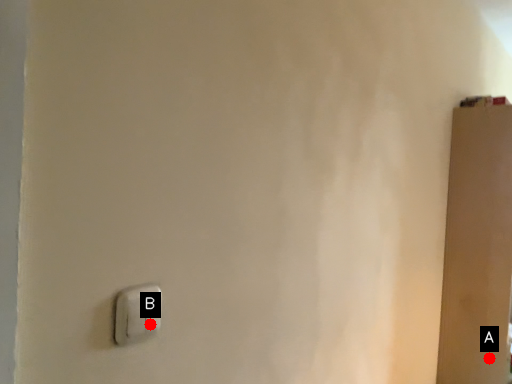
Question: Two points are circled on the image, labeled by A and B beside each circle. Among these points, which one is nearest to the camera?

Choices:
 (A) A is closer
 (B) B is closer

Answer: (B)